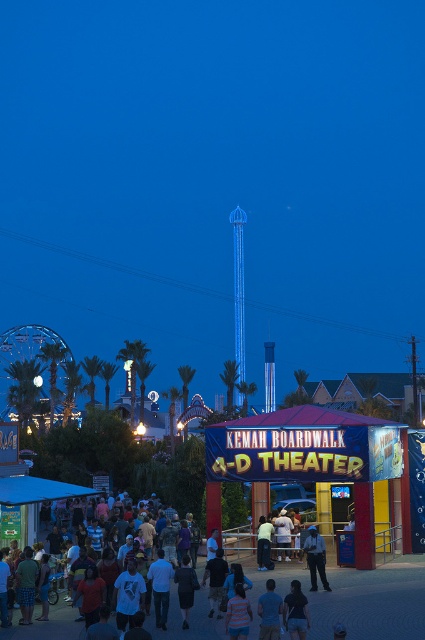
Question: Which point is closer to the camera taking this photo?

Choices:
 (A) (204, 589)
 (B) (311, 529)

Answer: (A)

Question: Does dark blue shirt at center appear over dark blue jeans at center?

Choices:
 (A) yes
 (B) no

Answer: (B)

Question: Which of the following is the farthest from the observer?

Choices:
 (A) (51, 621)
 (B) (317, 552)

Answer: (B)

Question: Does dark blue shirt at center have a lesser width compared to dark blue jeans at center?

Choices:
 (A) yes
 (B) no

Answer: (B)

Question: Is dark blue shirt at center bigger than dark blue jeans at center?

Choices:
 (A) yes
 (B) no

Answer: (A)

Question: Which point appears farthest from the camera in this image?

Choices:
 (A) (311, 540)
 (B) (252, 561)

Answer: (B)